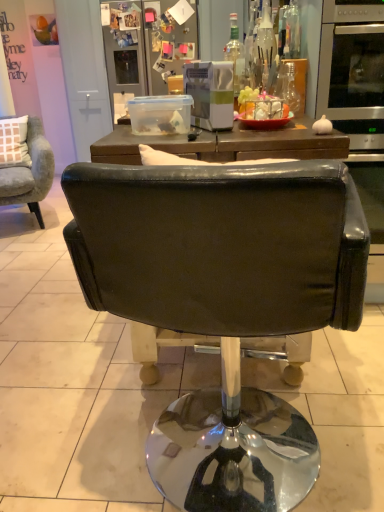
What do you see at coordinates (353, 72) in the screenshot?
I see `stainless steel oven at right` at bounding box center [353, 72].

What do you see at coordinates (224, 275) in the screenshot?
I see `black leather chair at center, which is counted as the 1th chair, starting from the front` at bounding box center [224, 275].

What do you see at coordinates (235, 55) in the screenshot? I see `clear glass bottle at upper center, which is the 4th bottle in right-to-left order` at bounding box center [235, 55].

What do you see at coordinates (148, 42) in the screenshot? I see `metallic silver refrigerator at upper center` at bounding box center [148, 42].

Measure the distance between velvet grey armchair at left, acting as the second chair starting from the right, and camera.

10.19 feet.

This screenshot has width=384, height=512. Describe the element at coordinates (250, 37) in the screenshot. I see `transparent glass bottle at upper center, the second bottle when ordered from left to right` at that location.

You are a GUI agent. You are given a task and a screenshot of the screen. Output one action in this format:
    pyautogui.click(x=<x>, y=<y>)
    Task: Click on the stainless steel oven at right
    This screenshot has height=512, width=384.
    Given the screenshot: What is the action you would take?
    pyautogui.click(x=353, y=72)

Is black leather chair at center, positioned as the 1th chair in bottom-to-top order, positioned with its back to transparent glass bottle at upper center, the 3th bottle when ordered from right to left?

That's not correct — black leather chair at center, positioned as the 1th chair in bottom-to-top order, is not looking away from transparent glass bottle at upper center, the 3th bottle when ordered from right to left.

From the image's perspective, starting from the black leather chair at center, the 1th chair positioned from the right, which bottle is the 4th one above? Please provide its 2D coordinates.

[(250, 37)]

Relative to transparent glass bottle at upper center, the 3th bottle when ordered from right to left, is black leather chair at center, positioned as the 1th chair in bottom-to-top order, in front or behind?

Clearly, black leather chair at center, positioned as the 1th chair in bottom-to-top order, is in front of transparent glass bottle at upper center, the 3th bottle when ordered from right to left.

Considering their positions, is transparent glass bottle at upper center, the 3th bottle when ordered from right to left, located in front of or behind black leather chair at center, which is counted as the 1th chair, starting from the front?

Visually, transparent glass bottle at upper center, the 3th bottle when ordered from right to left, is located behind black leather chair at center, which is counted as the 1th chair, starting from the front.

Considering the relative sizes of transparent glass bottle at upper center, the 3th bottle when ordered from right to left, and black leather chair at center, which is counted as the 1th chair, starting from the front, in the image provided, is transparent glass bottle at upper center, the 3th bottle when ordered from right to left, smaller than black leather chair at center, which is counted as the 1th chair, starting from the front,?

Correct, transparent glass bottle at upper center, the 3th bottle when ordered from right to left, occupies less space than black leather chair at center, which is counted as the 1th chair, starting from the front.

Considering the sizes of objects transparent glass bottle at upper center, the second bottle when ordered from left to right, and black leather chair at center, placed as the second chair when sorted from back to front, in the image provided, who is taller, transparent glass bottle at upper center, the second bottle when ordered from left to right, or black leather chair at center, placed as the second chair when sorted from back to front,?

black leather chair at center, placed as the second chair when sorted from back to front.

Is transparent glass bottle at upper center, the 3th bottle when ordered from right to left, not close to black leather chair at center, positioned as the 1th chair in bottom-to-top order?

Absolutely, transparent glass bottle at upper center, the 3th bottle when ordered from right to left, is distant from black leather chair at center, positioned as the 1th chair in bottom-to-top order.

Between clear glass bottle at upper center, which is the 4th bottle in right-to-left order, and stainless steel oven at right, which one appears on the right side from the viewer's perspective?

From the viewer's perspective, stainless steel oven at right appears more on the right side.

From a real-world perspective, is clear glass bottle at upper center, which is the 4th bottle in right-to-left order, on stainless steel oven at right?

Yes, from a real-world perspective, clear glass bottle at upper center, which is the 4th bottle in right-to-left order, is over stainless steel oven at right

Looking at this image, from the image's perspective, which one is positioned lower, clear glass bottle at upper center, which ranks as the 1th bottle in left-to-right order, or stainless steel oven at right?

clear glass bottle at upper center, which ranks as the 1th bottle in left-to-right order, is shown below in the image.

Is clear glass bottle at upper center, which ranks as the 1th bottle in left-to-right order, positioned in front of stainless steel oven at right?

No, the depth of clear glass bottle at upper center, which ranks as the 1th bottle in left-to-right order, is greater than that of stainless steel oven at right.

From their relative heights in the image, would you say transparent glass bottle at upper right, which ranks as the third bottle in left-to-right order, is taller or shorter than transparent glass bottle at upper center, the 3th bottle when ordered from right to left?

Considering their sizes, transparent glass bottle at upper right, which ranks as the third bottle in left-to-right order, has less height than transparent glass bottle at upper center, the 3th bottle when ordered from right to left.

Image resolution: width=384 pixels, height=512 pixels. Identify the location of the 1st bottle to the left of the transparent glass bottle at upper right, which ranks as the third bottle in left-to-right order, starting your count from the anchor. (250, 37).

From a real-world perspective, who is located higher, transparent glass bottle at upper right, which is counted as the second bottle, starting from the right, or transparent glass bottle at upper center, the 3th bottle when ordered from right to left?

transparent glass bottle at upper center, the 3th bottle when ordered from right to left, from a real-world perspective.

Is transparent glass bottle at upper right, which ranks as the third bottle in left-to-right order, next to transparent glass bottle at upper center, the second bottle when ordered from left to right, and touching it?

transparent glass bottle at upper right, which ranks as the third bottle in left-to-right order, and transparent glass bottle at upper center, the second bottle when ordered from left to right, are not in contact.

Which of these two, black leather chair at center, placed as the second chair when sorted from back to front, or transparent glass bottle at upper right, which ranks as the third bottle in left-to-right order, is thinner?

With smaller width is transparent glass bottle at upper right, which ranks as the third bottle in left-to-right order.

Is transparent glass bottle at upper right, which is counted as the second bottle, starting from the right, surrounded by black leather chair at center, positioned as the 1th chair in bottom-to-top order?

No.

Which of these two, black leather chair at center, the 1th chair positioned from the right, or transparent glass bottle at upper right, which ranks as the third bottle in left-to-right order, stands shorter?

Standing shorter between the two is transparent glass bottle at upper right, which ranks as the third bottle in left-to-right order.

Is black leather chair at center, which ranks as the 2th chair in left-to-right order, oriented towards transparent glass bottle at upper right, which is counted as the second bottle, starting from the right?

Yes, black leather chair at center, which ranks as the 2th chair in left-to-right order, faces towards transparent glass bottle at upper right, which is counted as the second bottle, starting from the right.

From the image's perspective, between velvet grey armchair at left, positioned as the 2th chair in front-to-back order, and metallic silver refrigerator at upper center, who is located below?

velvet grey armchair at left, positioned as the 2th chair in front-to-back order, is shown below in the image.

Which chair is the 1st one when counting from the front of the metallic silver refrigerator at upper center? Please provide its 2D coordinates.

[(30, 173)]

Is velvet grey armchair at left, which is counted as the second chair, starting from the bottom, oriented away from metallic silver refrigerator at upper center?

No, metallic silver refrigerator at upper center is not at the back of velvet grey armchair at left, which is counted as the second chair, starting from the bottom.

From a real-world perspective, which object stands above the other?

transparent glass bottle at upper center, the 3th bottle when ordered from right to left, is physically above.

Considering the sizes of objects transparent glass bottle at upper center, the 3th bottle when ordered from right to left, and velvet grey armchair at left, which is counted as the second chair, starting from the bottom, in the image provided, who is wider, transparent glass bottle at upper center, the 3th bottle when ordered from right to left, or velvet grey armchair at left, which is counted as the second chair, starting from the bottom,?

With larger width is velvet grey armchair at left, which is counted as the second chair, starting from the bottom.

Considering the relative sizes of transparent glass bottle at upper center, the second bottle when ordered from left to right, and velvet grey armchair at left, acting as the second chair starting from the right, in the image provided, is transparent glass bottle at upper center, the second bottle when ordered from left to right, smaller than velvet grey armchair at left, acting as the second chair starting from the right,?

Yes, transparent glass bottle at upper center, the second bottle when ordered from left to right, is smaller than velvet grey armchair at left, acting as the second chair starting from the right.

From the black leather chair at center, the 1th chair positioned from the right, count 4th bottles backward and point to it. Please provide its 2D coordinates.

[(250, 37)]

At what (x,y) coordinates should I click in order to perform the action: click on chair located in front of the transparent glass bottle at upper center, the 3th bottle when ordered from right to left. Please return your answer as a coordinate pair (x, y). This screenshot has width=384, height=512. Looking at the image, I should click on (224, 275).

Looking at the image, which one is located closer to clear glass bottle at upper center, which ranks as the 1th bottle in left-to-right order, velvet grey armchair at left, which is counted as the second chair, starting from the bottom, or transparent glass bottle at upper right, which is counted as the fourth bottle, starting from the left?

The object closer to clear glass bottle at upper center, which ranks as the 1th bottle in left-to-right order, is transparent glass bottle at upper right, which is counted as the fourth bottle, starting from the left.

Looking at the image, which one is located closer to metallic silver refrigerator at upper center, black leather chair at center, the 1th chair positioned from the right, or stainless steel oven at right?

Based on the image, stainless steel oven at right appears to be nearer to metallic silver refrigerator at upper center.

From the image, which object appears to be nearer to transparent glass bottle at upper right, the 1th bottle in the right-to-left sequence, transparent glass bottle at upper center, the second bottle when ordered from left to right, or black leather chair at center, the 1th chair positioned from the right?

transparent glass bottle at upper center, the second bottle when ordered from left to right, is positioned closer to the anchor transparent glass bottle at upper right, the 1th bottle in the right-to-left sequence.

When comparing their distances from velvet grey armchair at left, which is counted as the second chair, starting from the bottom, does stainless steel oven at right or metallic silver refrigerator at upper center seem further?

stainless steel oven at right lies further to velvet grey armchair at left, which is counted as the second chair, starting from the bottom, than the other object.

When comparing their distances from clear glass bottle at upper center, which is the 4th bottle in right-to-left order, does transparent glass bottle at upper center, the 3th bottle when ordered from right to left, or stainless steel oven at right seem further?

Among the two, stainless steel oven at right is located further to clear glass bottle at upper center, which is the 4th bottle in right-to-left order.

Which object lies further to the anchor point stainless steel oven at right, transparent glass bottle at upper center, the 3th bottle when ordered from right to left, or metallic silver refrigerator at upper center?

metallic silver refrigerator at upper center is further to stainless steel oven at right.

Looking at the image, which one is located further to velvet grey armchair at left, arranged as the first chair when viewed from the top, clear glass bottle at upper center, which is the 4th bottle in right-to-left order, or black leather chair at center, positioned as the 1th chair in bottom-to-top order?

black leather chair at center, positioned as the 1th chair in bottom-to-top order.

When comparing their distances from velvet grey armchair at left, acting as the second chair starting from the right, does transparent glass bottle at upper right, the 1th bottle in the right-to-left sequence, or stainless steel oven at right seem closer?

Based on the image, transparent glass bottle at upper right, the 1th bottle in the right-to-left sequence, appears to be nearer to velvet grey armchair at left, acting as the second chair starting from the right.

Where is `chair positioned between transparent glass bottle at upper right, which is counted as the second bottle, starting from the right, and metallic silver refrigerator at upper center from near to far`? This screenshot has width=384, height=512. chair positioned between transparent glass bottle at upper right, which is counted as the second bottle, starting from the right, and metallic silver refrigerator at upper center from near to far is located at coordinates (30, 173).

Image resolution: width=384 pixels, height=512 pixels. I want to click on chair between clear glass bottle at upper center, which ranks as the 1th bottle in left-to-right order, and metallic silver refrigerator at upper center in the front-back direction, so click(x=30, y=173).

The height and width of the screenshot is (512, 384). Find the location of `chair between stainless steel oven at right and metallic silver refrigerator at upper center in the front-back direction`. chair between stainless steel oven at right and metallic silver refrigerator at upper center in the front-back direction is located at coordinates (30, 173).

Where is `chair between black leather chair at center, placed as the second chair when sorted from back to front, and metallic silver refrigerator at upper center in the front-back direction`? chair between black leather chair at center, placed as the second chair when sorted from back to front, and metallic silver refrigerator at upper center in the front-back direction is located at coordinates (30, 173).